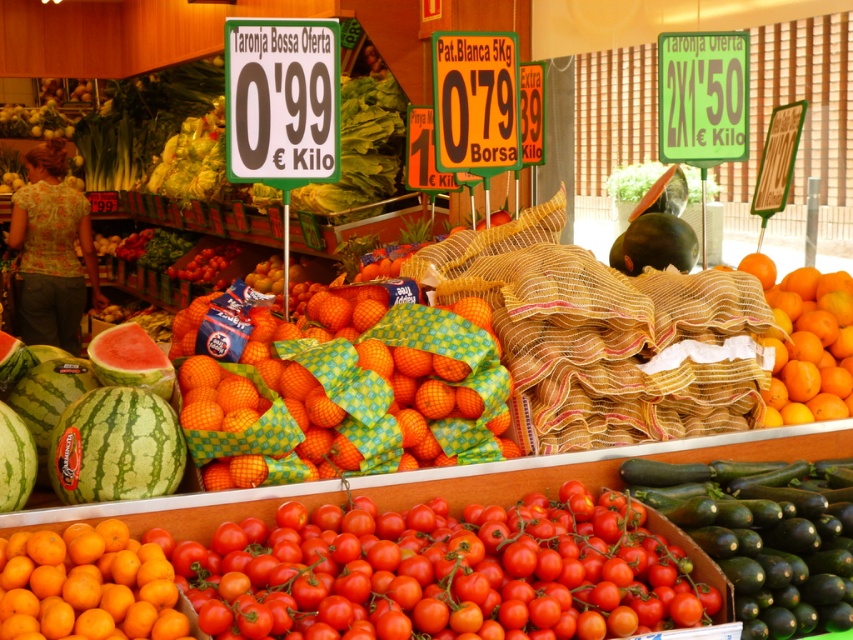
You are a customer in the market and want to pick up both items located at point (712,497) and point (490,150). Which point should you reach for first to minimize the distance you walk?

You should reach for point (712,497) first because it is closer to you than point (490,150), so you can pick it up without moving further away.